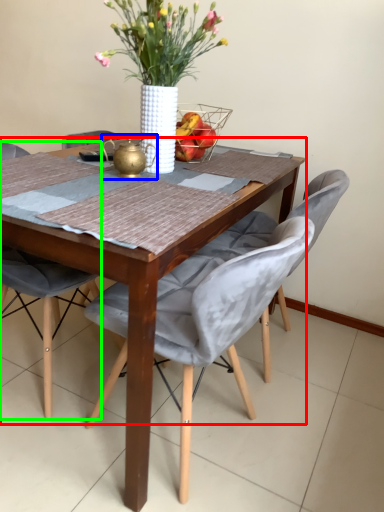
Question: Which is nearer to the round table (highlighted by a red box)? tea pot (highlighted by a blue box) or chair (highlighted by a green box).

Choices:
 (A) tea pot
 (B) chair

Answer: (A)